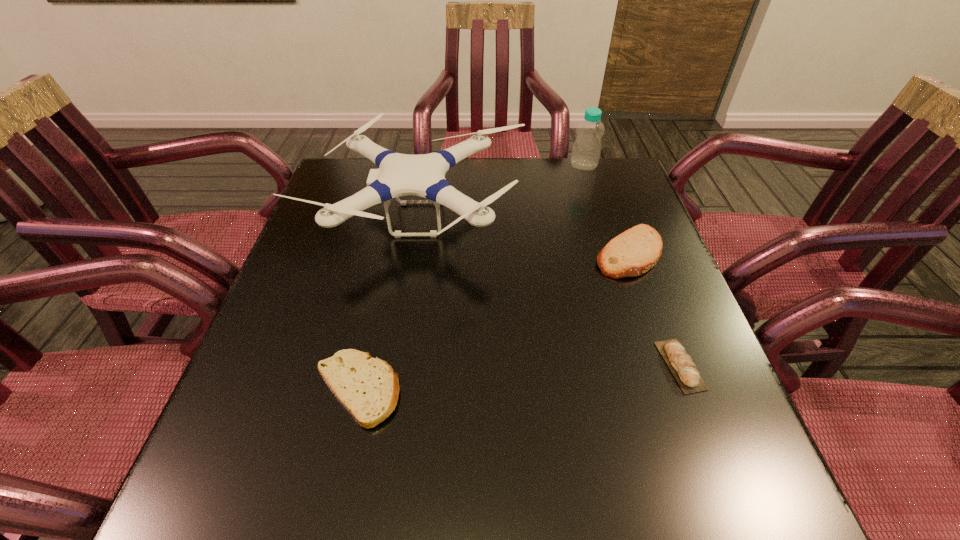
I want to click on bottle, so click(x=586, y=150).

Where is `drone`? The image size is (960, 540). drone is located at coordinates (423, 175).

In order to click on the farthest pita bread in this screenshot , I will do `click(635, 251)`.

Where is `the third tallest object`? the third tallest object is located at coordinates pyautogui.click(x=635, y=251).

What are the coordinates of `the leftmost pita bread` in the screenshot? It's located at (368, 388).

I want to click on vacant space located 0.190m on the front of the bottle, so click(x=597, y=209).

In order to click on vacant space located 0.120m on the right of the drone in this screenshot , I will do `click(571, 218)`.

Where is `vacant space located on the left of the farthest pita bread`? vacant space located on the left of the farthest pita bread is located at coordinates (457, 253).

Locate an element on the screen. Image resolution: width=960 pixels, height=540 pixels. free space located 0.310m on the back of the leftmost pita bread is located at coordinates (388, 249).

At what (x,y) coordinates should I click in order to perform the action: click on bottle that is at the far edge. Please return your answer as a coordinate pair (x, y). The image size is (960, 540). Looking at the image, I should click on (586, 150).